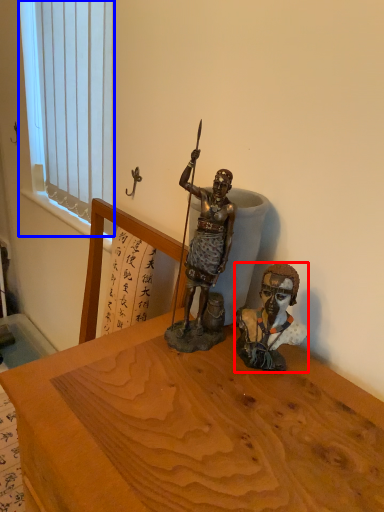
Question: Which of the following is the farthest to the observer, person (highlighted by a red box) or window (highlighted by a blue box)?

Choices:
 (A) person
 (B) window

Answer: (B)